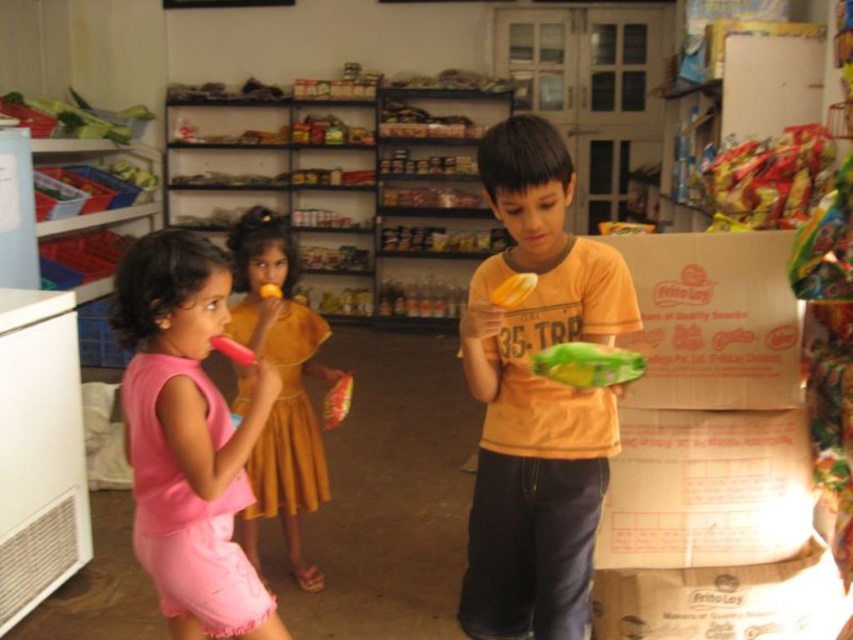
From the picture: Does pink fabric dress at center have a smaller size compared to pink plastic toy at center?

No, pink fabric dress at center is not smaller than pink plastic toy at center.

Between point (292, 547) and point (242, 364), which one is positioned behind?

The point (292, 547) is behind.

Does point (256, 320) lie behind point (254, 364)?

Yes, point (256, 320) is behind point (254, 364).

This screenshot has height=640, width=853. Find the location of `pink fabric dress at center`. pink fabric dress at center is located at coordinates (281, 387).

Describe the element at coordinates (537, 397) in the screenshot. I see `orange cotton shirt at center` at that location.

Between orange cotton shirt at center and pink fabric dress at left, which one is positioned higher?

orange cotton shirt at center is above.

Looking at this image, who is more forward, (575, 529) or (157, 561)?

Positioned in front is point (157, 561).

Identify the location of orange cotton shirt at center. This screenshot has height=640, width=853. pos(537,397).

Is orange cotton shirt at center below yellow matte snack at center?

Indeed, orange cotton shirt at center is positioned under yellow matte snack at center.

Which is in front, point (502, 538) or point (509, 285)?

Point (509, 285) is in front.

The image size is (853, 640). I want to click on orange cotton shirt at center, so click(x=537, y=397).

I want to click on orange cotton shirt at center, so click(537, 397).